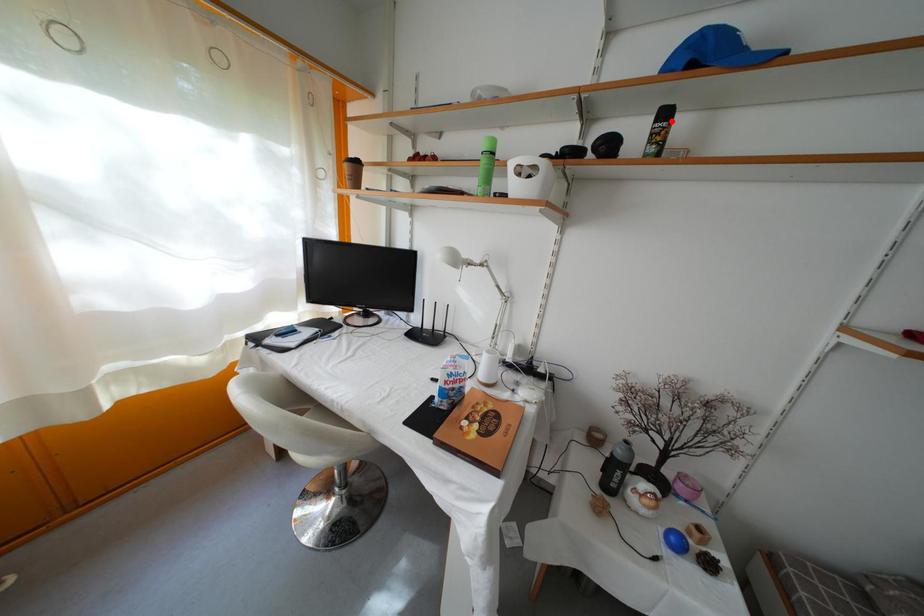
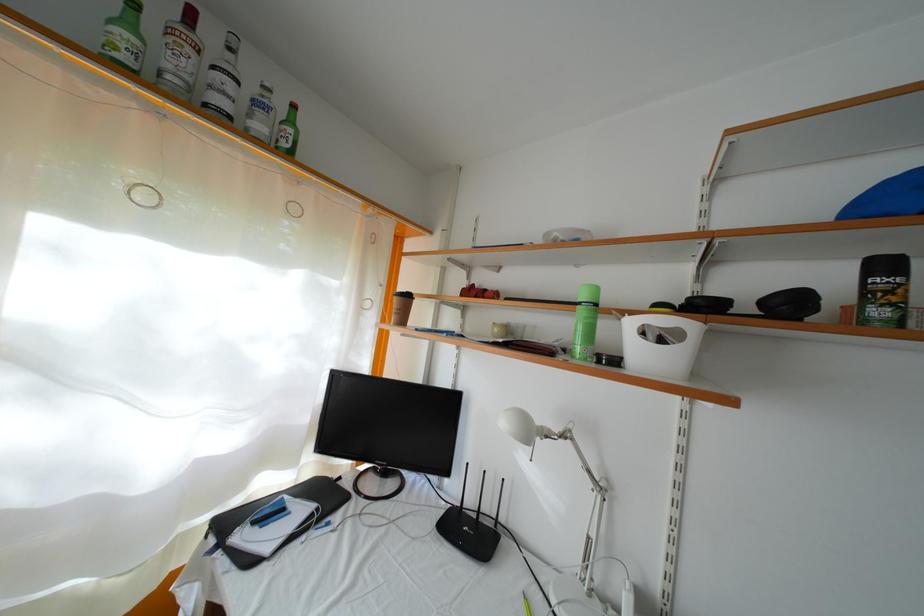
Find the pixel in the second image that matches the highlighted location in the first image.

(891, 273)